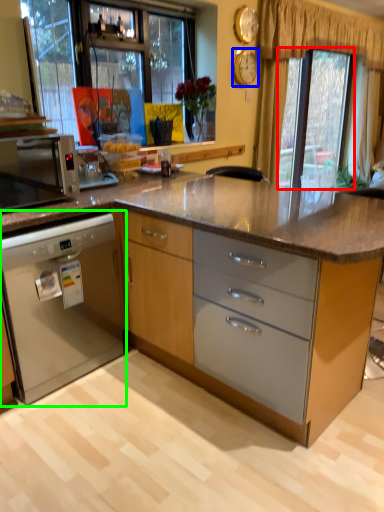
Question: Which object is the closest to the window screen (highlighted by a red box)? Choose among these: clock (highlighted by a blue box) or cabinetry (highlighted by a green box).

Choices:
 (A) clock
 (B) cabinetry

Answer: (A)